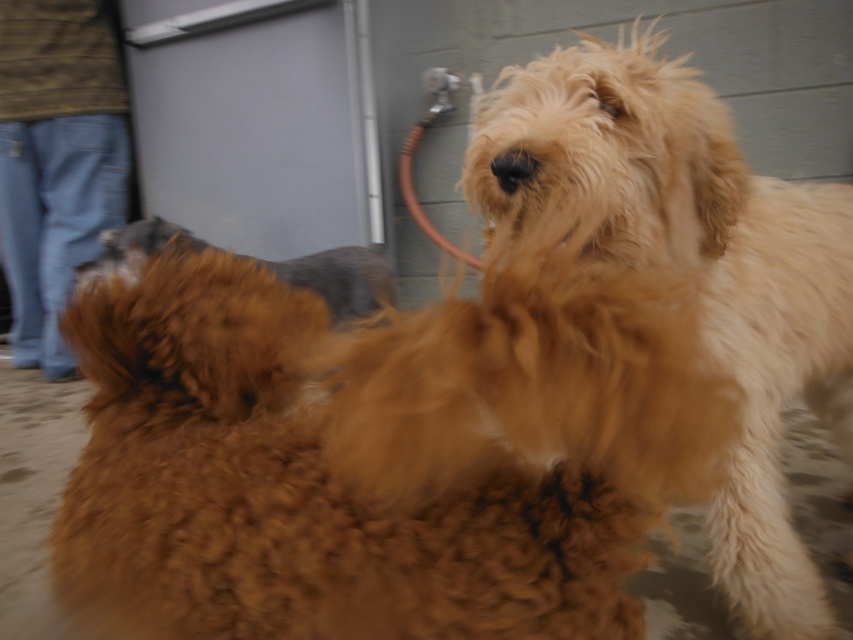
You are a drone operator trying to capture a photo of the two dogs. You have two points marked on your screen, point (724, 509) and point (186, 230). Which point is closer to the camera?

Point (724, 509) is closer to the viewer than point (186, 230).